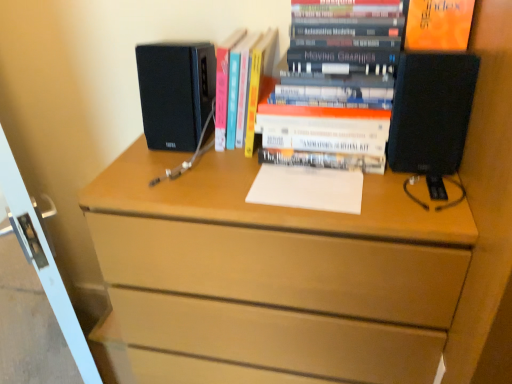
Locate an element on the screen. The image size is (512, 384). vacant area that is in front of black matte speaker at right, which ranks as the first desktop computer in right-to-left order is located at coordinates (415, 199).